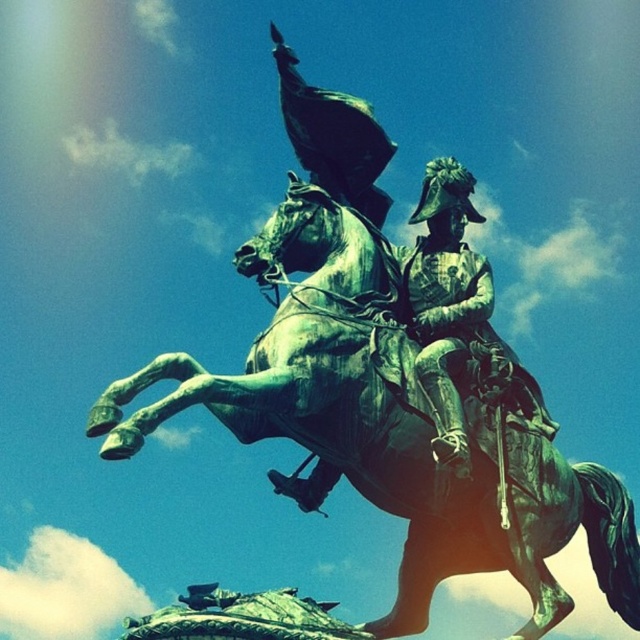
Question: Where is green patinated bronze horse at center located in relation to green patina helmet at center in the image?

Choices:
 (A) right
 (B) left

Answer: (B)

Question: Can you confirm if green patinated bronze horse at center is wider than green patina helmet at center?

Choices:
 (A) yes
 (B) no

Answer: (A)

Question: Which object appears farthest from the camera in this image?

Choices:
 (A) green patina helmet at center
 (B) green patinated bronze horse at center

Answer: (A)

Question: Which point is closer to the camera?

Choices:
 (A) (346, 244)
 (B) (444, 323)

Answer: (B)

Question: Does green patinated bronze horse at center come behind green patina helmet at center?

Choices:
 (A) yes
 (B) no

Answer: (B)